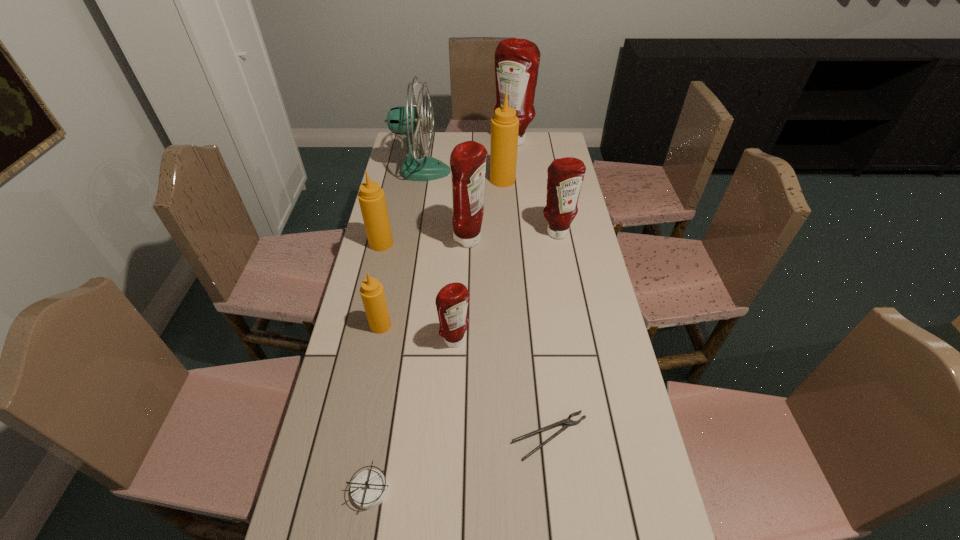
This screenshot has height=540, width=960. I want to click on object that is positioned at the far right corner, so click(x=517, y=61).

The width and height of the screenshot is (960, 540). I want to click on vacant space at the far edge, so click(x=455, y=137).

At what (x,y) coordinates should I click in order to perform the action: click on free space at the left edge. Please return your answer as a coordinate pair (x, y). The width and height of the screenshot is (960, 540). Looking at the image, I should click on (373, 452).

Identify the location of vacant space at the right edge. (537, 180).

You are a GUI agent. You are given a task and a screenshot of the screen. Output one action in this format:
    pyautogui.click(x=<x>, y=<y>)
    Task: Click on the free space between the second smallest red condiment and the nearest object
    The width and height of the screenshot is (960, 540).
    Given the screenshot: What is the action you would take?
    pyautogui.click(x=464, y=361)

Identify the location of vacant region between the third smallest red condiment and the second farthest tan condiment. (425, 242).

The width and height of the screenshot is (960, 540). I want to click on empty space that is in between the third smallest red condiment and the teal fan, so click(445, 206).

This screenshot has height=540, width=960. I want to click on empty location between the second farthest condiment and the smallest tan condiment, so click(x=442, y=253).

In order to click on free space between the compass and the second farthest tan condiment in this screenshot , I will do `click(375, 366)`.

Find the location of `vacant space that's between the compass and the farthest tan condiment`. vacant space that's between the compass and the farthest tan condiment is located at coordinates (437, 335).